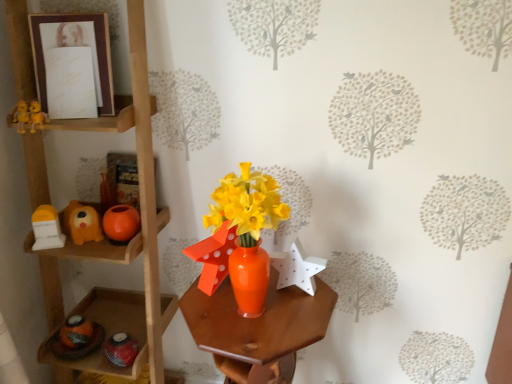
You are a GUI agent. You are given a task and a screenshot of the screen. Output one action in this format:
    pyautogui.click(x=<x>, y=<y>)
    Task: Click on the vacant space situated above orange glossy vase at center (from a real-world perspective)
    Image resolution: width=512 pixels, height=384 pixels.
    Given the screenshot: What is the action you would take?
    pyautogui.click(x=261, y=309)